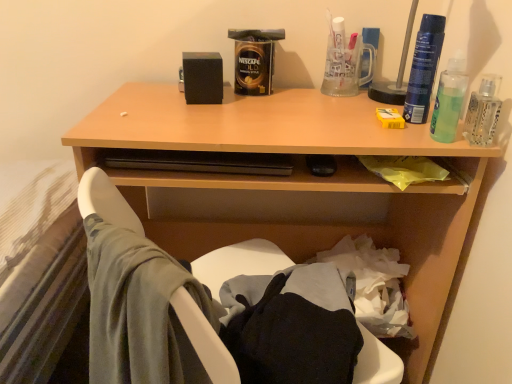
What are the coordinates of `free space behind blue plastic spray can at upper right, the 1th bottle viewed from the left` in the screenshot? It's located at (379, 99).